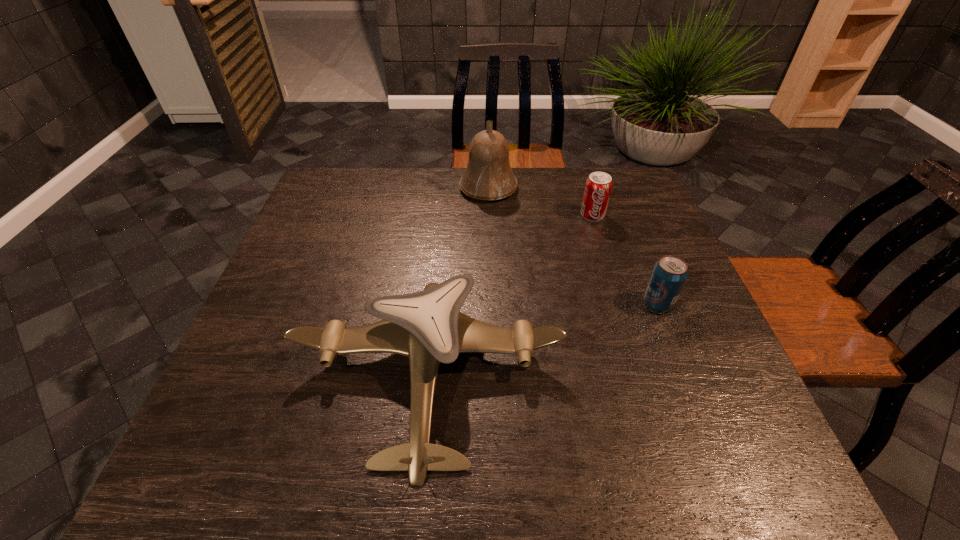
Identify which object is located as the nearest to the rightmost object. Please provide its 2D coordinates. Your answer should be formatted as a tuple, i.e. [(x, y)], where the tuple contains the x and y coordinates of a point satisfying the conditions above.

[(427, 326)]

Choose which object is the nearest neighbor to the second farthest object. Please provide its 2D coordinates. Your answer should be formatted as a tuple, i.e. [(x, y)], where the tuple contains the x and y coordinates of a point satisfying the conditions above.

[(488, 176)]